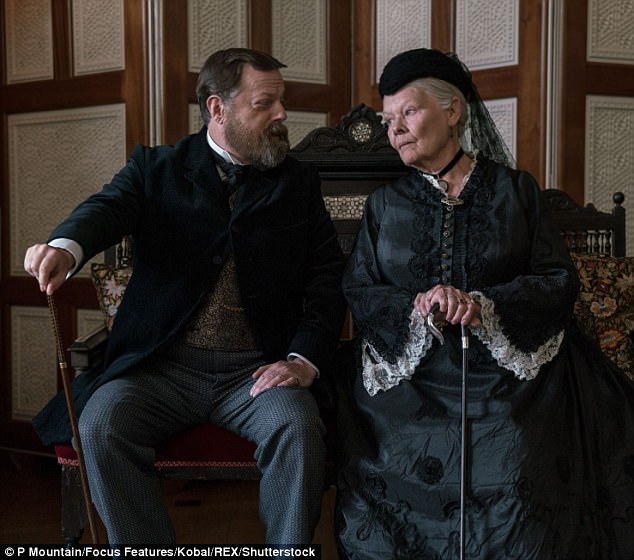
At what (x,y) coordinates should I click in order to perform the action: click on bench. Please return your answer as a coordinate pair (x, y). This screenshot has height=560, width=634. Looking at the image, I should click on (344, 188).